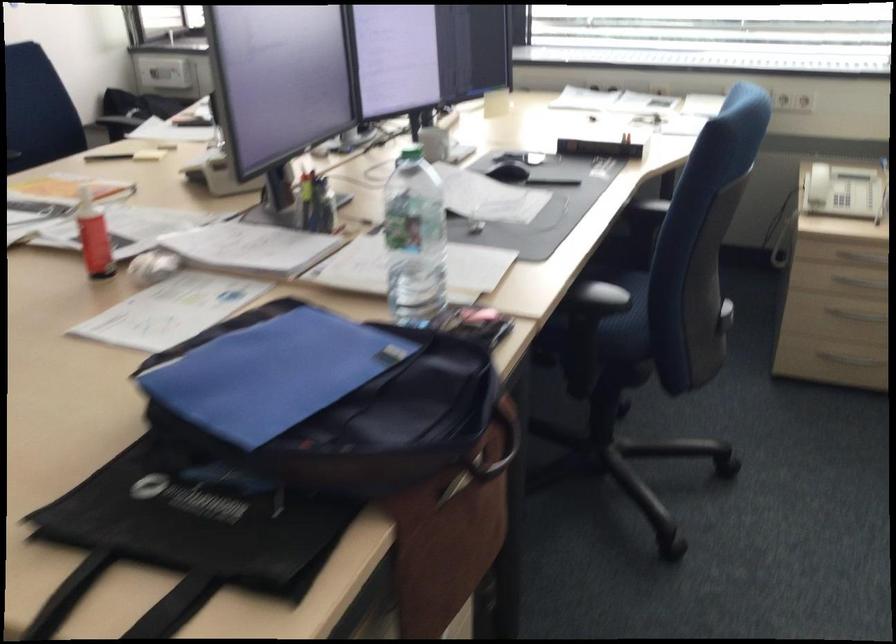
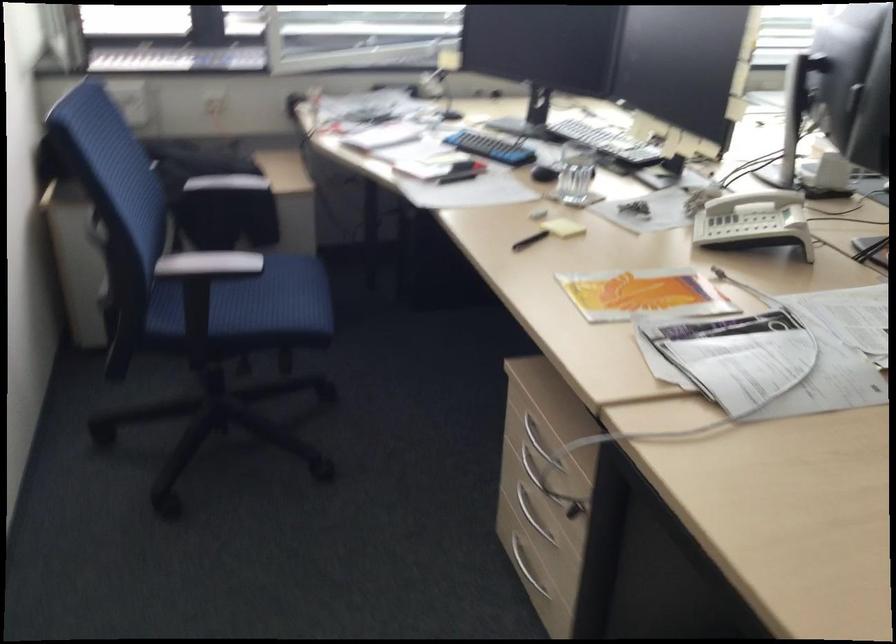
The point at (208, 161) is marked in the first image. Where is the corresponding point in the second image?

(751, 225)